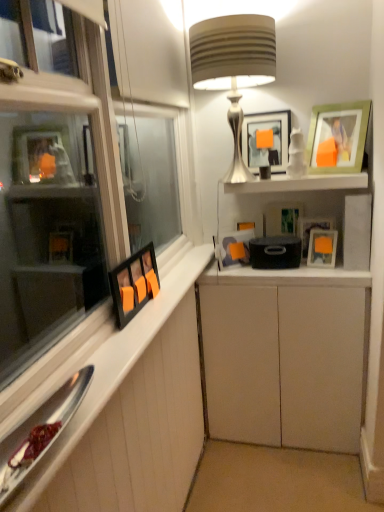
In order to click on free space in front of matte black picture frame at left, which ranks as the 7th picture frame in right-to-left order in this screenshot , I will do `click(140, 330)`.